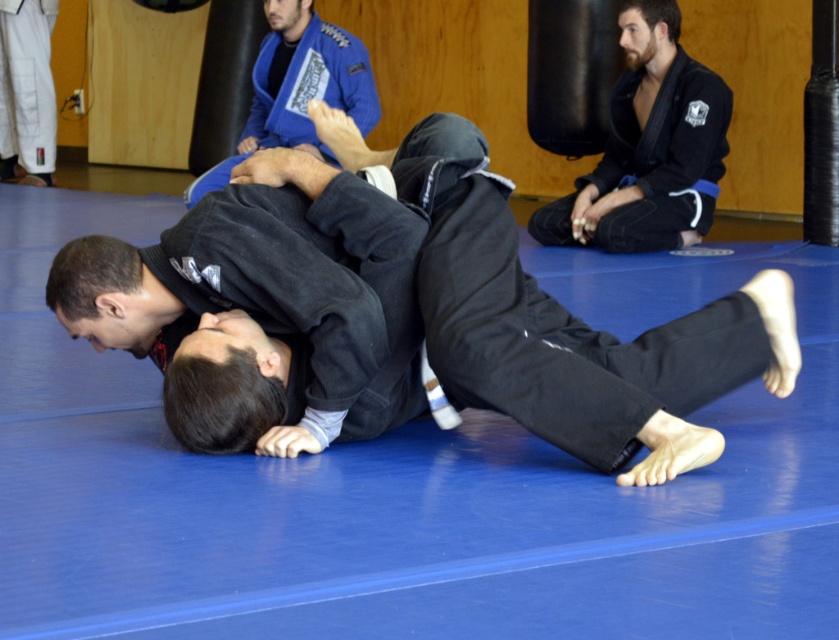
You are a photographer standing at the entrance of the gym. You need to take a photo of both the black matte gi at center and the black matte gi at upper right. Given that your camera has a maximum focus range of 4 meters, will you be able to capture both in focus without moving?

The black matte gi at center is 4.48 meters away from the black matte gi at upper right. Since the distance between them exceeds the camera maximum focus range of 4 meters, you won be able to capture both in focus without moving.

You are a BJJ instructor observing the grappling session between the black matte gi at upper right and the blue fabric gi at upper center. Which fighter is currently in a dominant position?

The blue fabric gi at upper center is in a dominant position because the black matte gi at upper right is below them.

From the picture: Where is the black matte gi at center located in the image?

The black matte gi at center is located at point [266,308].